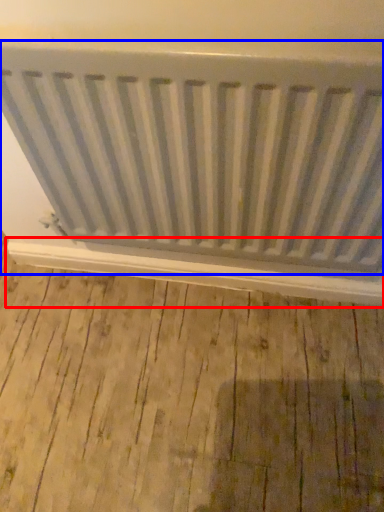
Question: Which object appears farthest to the camera in this image, window sill (highlighted by a red box) or radiator (highlighted by a blue box)?

Choices:
 (A) window sill
 (B) radiator

Answer: (A)